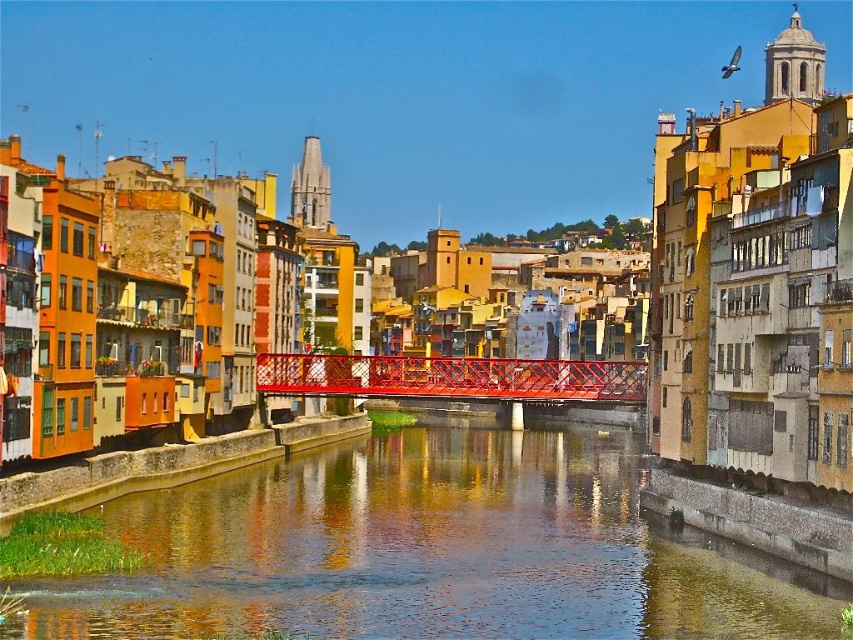
Which is more to the right, smooth concrete river at center or metallic red bridge at center?

metallic red bridge at center is more to the right.

Can you confirm if smooth concrete river at center is bigger than metallic red bridge at center?

Actually, smooth concrete river at center might be smaller than metallic red bridge at center.

Between point (245, 588) and point (527, 372), which one is positioned in front?

Positioned in front is point (245, 588).

Where is `smooth concrete river at center`? smooth concrete river at center is located at coordinates (428, 552).